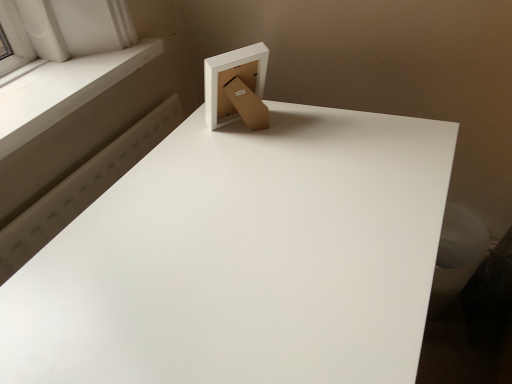
Where is `free space in front of matte cardboard box at upper center`? The image size is (512, 384). free space in front of matte cardboard box at upper center is located at coordinates (251, 171).